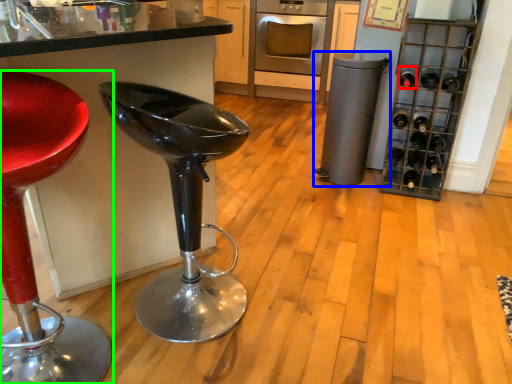
Question: Estimate the real-world distances between objects in this image. Which object is farther from wine bottle (highlighted by a red box), appliance (highlighted by a blue box) or chair (highlighted by a green box)?

Choices:
 (A) appliance
 (B) chair

Answer: (B)